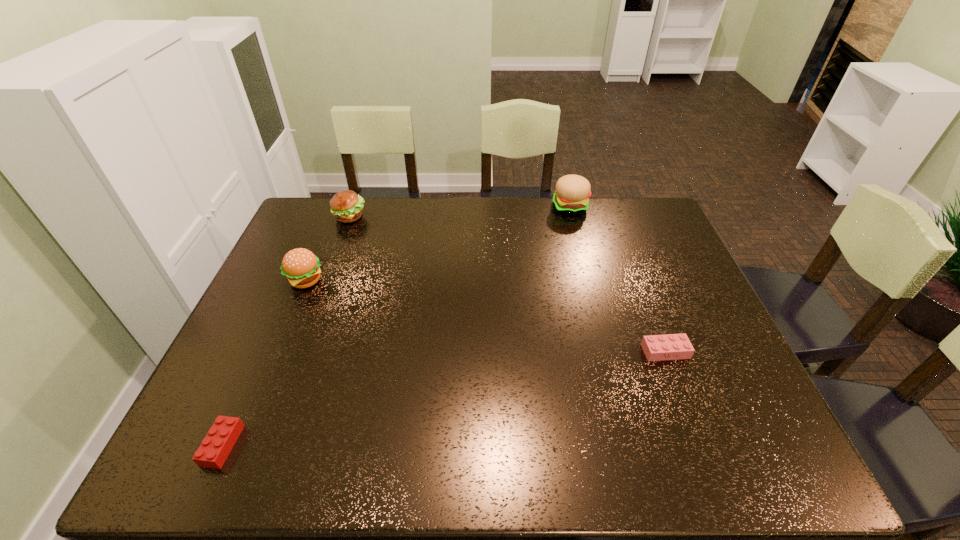
This screenshot has height=540, width=960. What are the coordinates of `unoccupied position between the third farthest object and the fourth farthest object` in the screenshot? It's located at (485, 316).

The width and height of the screenshot is (960, 540). Identify the location of free space between the rightmost hamburger and the third nearest object. (438, 244).

Where is `free point between the nearer Lego and the farther Lego`? free point between the nearer Lego and the farther Lego is located at coordinates (444, 399).

Locate an element on the screen. The image size is (960, 540). unoccupied area between the rightmost hamburger and the farther Lego is located at coordinates (617, 279).

Identify which object is the fourth closest to the rightmost hamburger. Please provide its 2D coordinates. Your answer should be formatted as a tuple, i.e. [(x, y)], where the tuple contains the x and y coordinates of a point satisfying the conditions above.

[(212, 453)]

Select which object appears as the closest to the rightmost hamburger. Please provide its 2D coordinates. Your answer should be formatted as a tuple, i.e. [(x, y)], where the tuple contains the x and y coordinates of a point satisfying the conditions above.

[(671, 346)]

Identify the location of hamburger that stands as the second closest to the nearest hamburger. (572, 194).

Identify which hamburger is the second nearest to the right Lego. Please provide its 2D coordinates. Your answer should be formatted as a tuple, i.e. [(x, y)], where the tuple contains the x and y coordinates of a point satisfying the conditions above.

[(300, 266)]

The height and width of the screenshot is (540, 960). I want to click on free space that satisfies the following two spatial constraints: 1. on the back side of the rightmost object; 2. on the left side of the left Lego, so click(x=264, y=352).

Locate an element on the screen. free space that satisfies the following two spatial constraints: 1. on the front side of the third nearest object; 2. on the left side of the rightmost object is located at coordinates (276, 352).